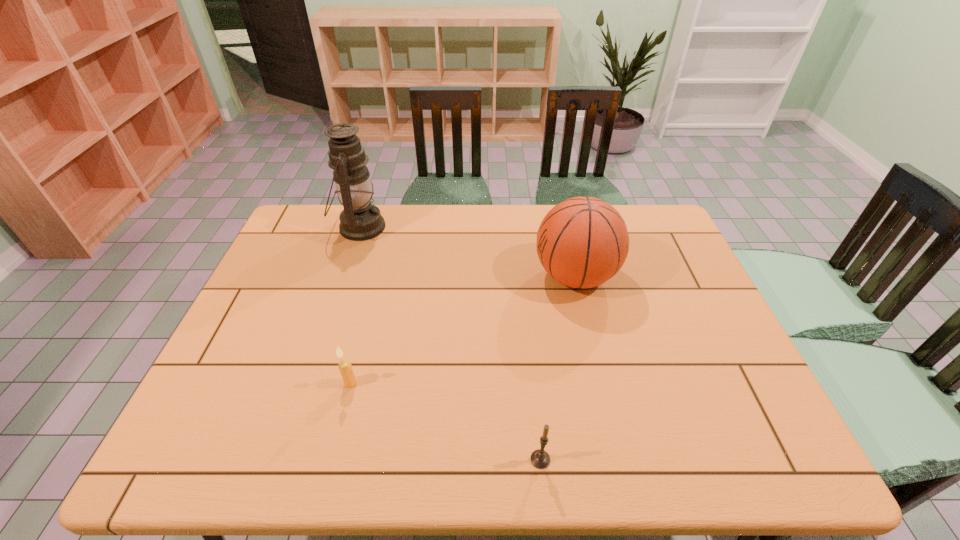
The image size is (960, 540). What are the coordinates of `vacant area that lies between the farther candle and the third nearest object` in the screenshot? It's located at [463, 330].

At what (x,y) coordinates should I click in order to perform the action: click on free spot between the second farthest object and the right candle. Please return your answer as a coordinate pair (x, y). Image resolution: width=960 pixels, height=540 pixels. Looking at the image, I should click on (558, 368).

Locate which object is the second closest to the third shortest object. Please provide its 2D coordinates. Your answer should be formatted as a tuple, i.e. [(x, y)], where the tuple contains the x and y coordinates of a point satisfying the conditions above.

[(360, 220)]

I want to click on object that is the third closest to the third nearest object, so click(x=345, y=367).

Find the location of a particular element. Image resolution: width=960 pixels, height=540 pixels. vacant space that satisfies the following two spatial constraints: 1. on the back side of the second nearest object; 2. on the left side of the rightmost object is located at coordinates (377, 276).

Find the location of a particular element. The image size is (960, 540). vacant space that satisfies the following two spatial constraints: 1. on the back side of the second tallest object; 2. on the left side of the left candle is located at coordinates (377, 276).

Locate an element on the screen. free spot that satisfies the following two spatial constraints: 1. on the front side of the farthest object; 2. on the left side of the third farthest object is located at coordinates (308, 383).

Find the location of a particular element. Image resolution: width=960 pixels, height=540 pixels. vacant space that satisfies the following two spatial constraints: 1. on the back side of the rightmost object; 2. on the right side of the second object from right to left is located at coordinates (522, 276).